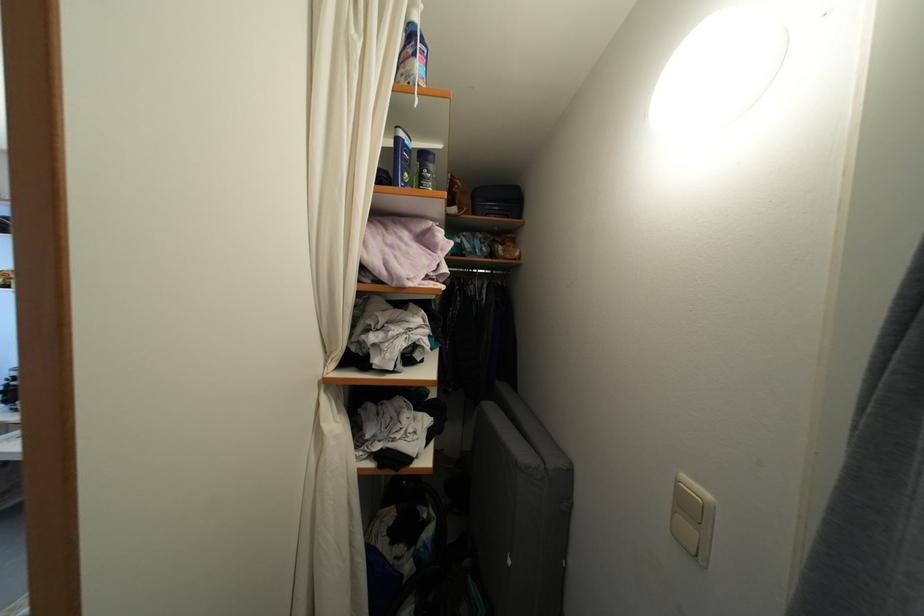
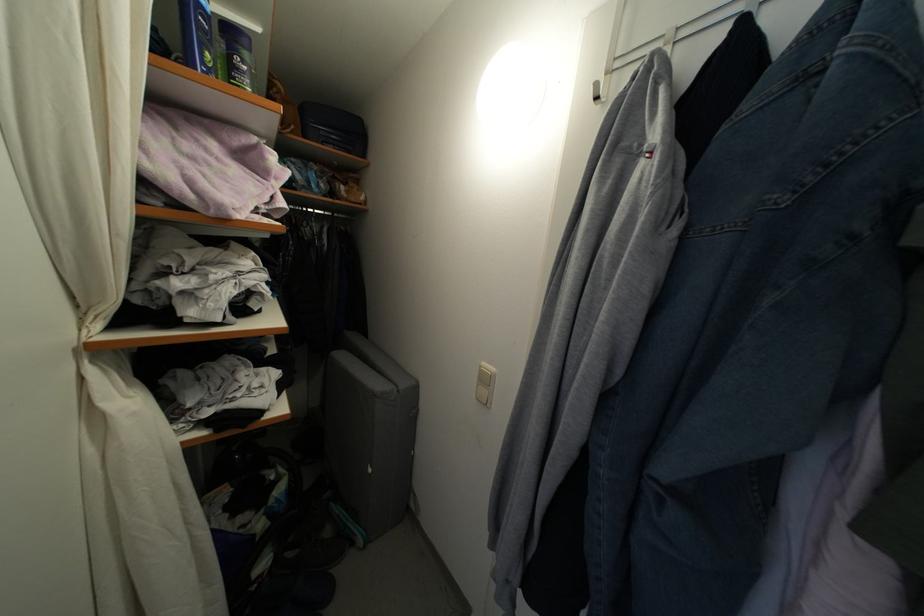
Where in the second image is the point corresponding to [408,187] from the first image?

(210, 70)